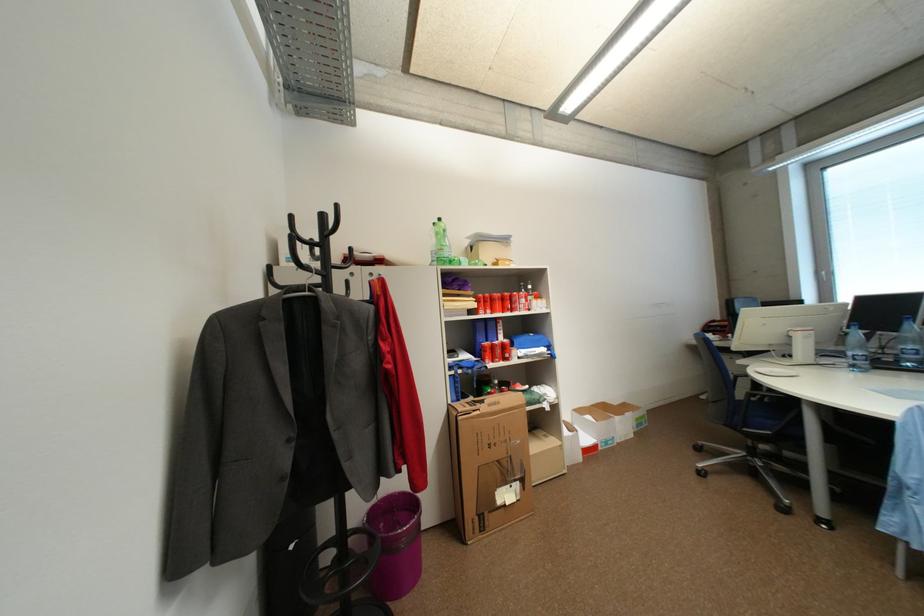
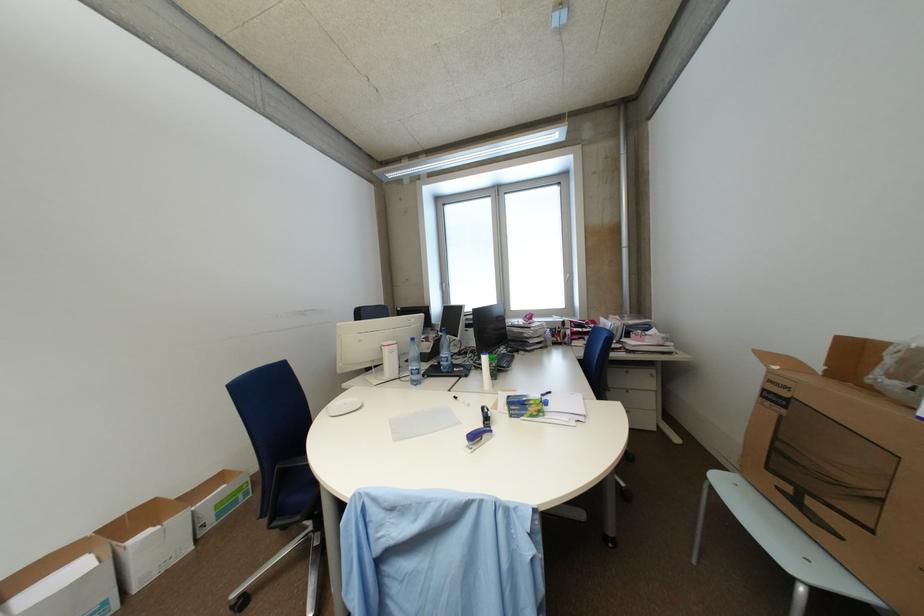
In the second image, find the point that corresponds to point (602, 403) in the first image.

(131, 514)